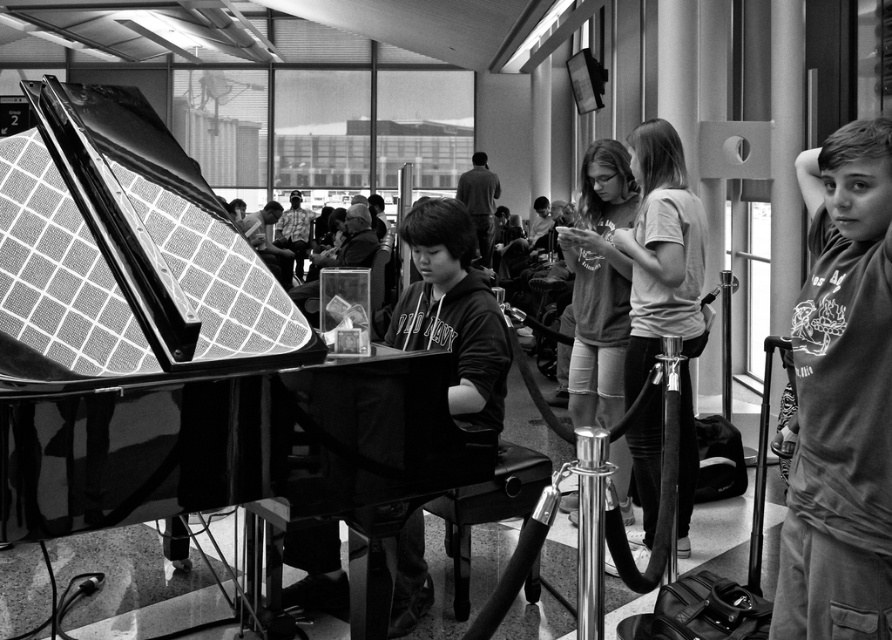
You are a traveler in the airport terminal and you see the smooth gray hoodie at right and the smooth black hoodie at center. Which one is located more to the right side of the scene?

The smooth gray hoodie at right is located more to the right side of the scene compared to the smooth black hoodie at center.

Based on the photo, you are a traveler in the airport terminal looking for your luggage. You see the smooth gray hoodie at right and the smooth black hoodie at center. Which hoodie is closer to the ground?

The smooth gray hoodie at right is positioned under the smooth black hoodie at center, so it is closer to the ground.